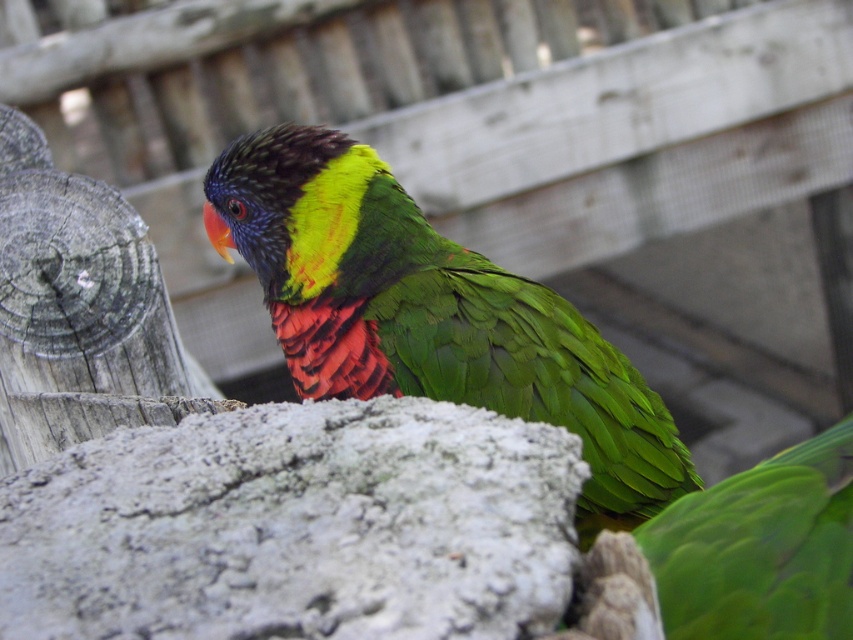
Can you confirm if shiny green parrot at center is bigger than green matte parrot at center?

Indeed, shiny green parrot at center has a larger size compared to green matte parrot at center.

Is point (395, 348) farther from viewer compared to point (840, 577)?

Yes, point (395, 348) is farther from viewer.

I want to click on shiny green parrot at center, so click(430, 314).